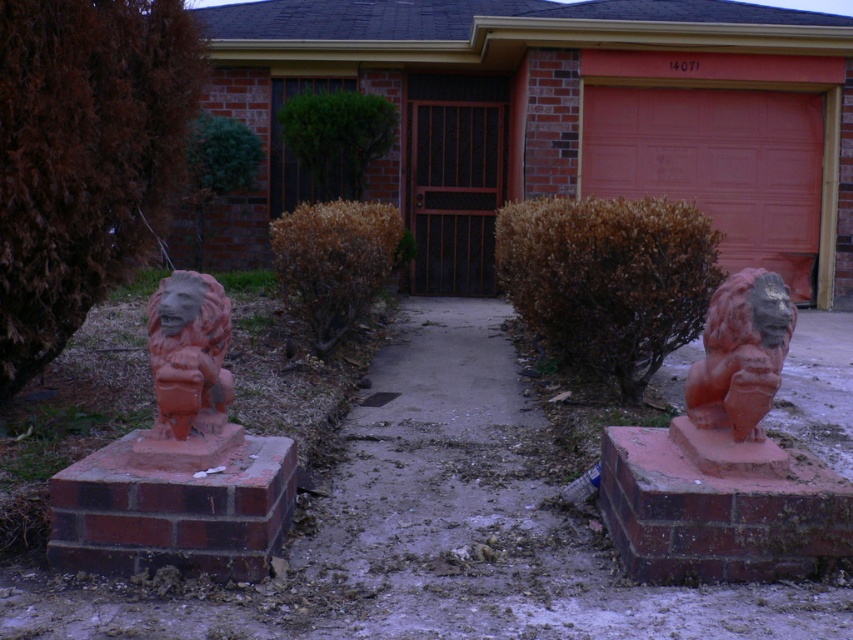
Can you confirm if matte orange garage door at center is bigger than matte terracotta lion at left?

Actually, matte orange garage door at center might be smaller than matte terracotta lion at left.

Who is more forward, (339, 74) or (202, 307)?

Point (202, 307) is more forward.

Where is `matte orange garage door at center`? This screenshot has height=640, width=853. matte orange garage door at center is located at coordinates (560, 120).

Between brown metal/gate at center and matte terracotta lion at left, which one appears on the left side from the viewer's perspective?

matte terracotta lion at left

Does point (467, 177) come behind point (218, 412)?

Yes, it is.

This screenshot has width=853, height=640. What are the coordinates of `brown metal/gate at center` in the screenshot? It's located at (454, 180).

Which is above, matte red garage door at center or matte terracotta lion at left?

Positioned higher is matte red garage door at center.

In the scene shown: Measure the distance between matte red garage door at center and camera.

Result: matte red garage door at center and camera are 12.53 meters apart.

I want to click on matte red garage door at center, so click(x=717, y=164).